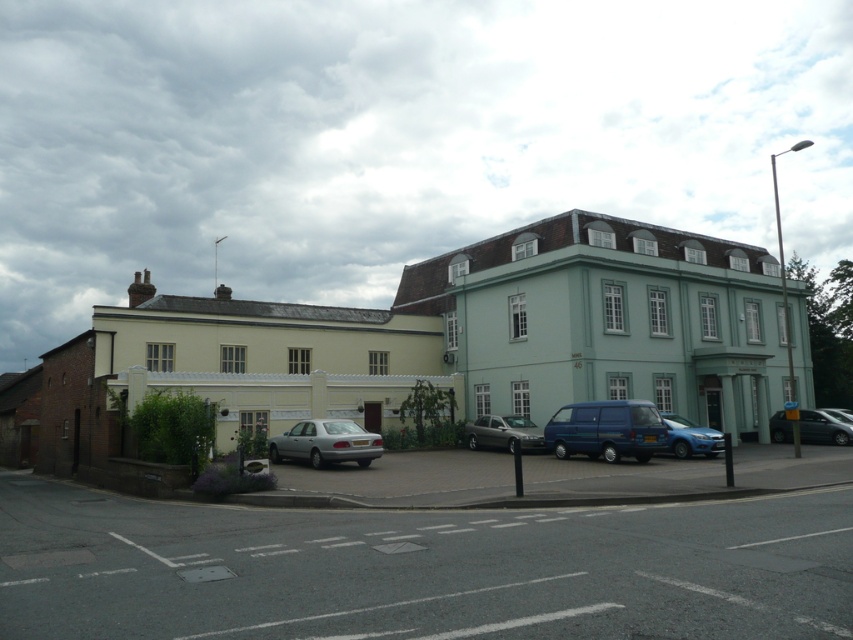
Question: Which is nearer to the metallic silver car at lower right?

Choices:
 (A) blue metallic van at center
 (B) satin silver sedan at center
 (C) satin silver sedan at lower left

Answer: (A)

Question: Can you confirm if gray asphalt parking lot at lower left is thinner than blue metallic van at center?

Choices:
 (A) yes
 (B) no

Answer: (B)

Question: Is blue metallic van at center bigger than satin silver sedan at lower left?

Choices:
 (A) no
 (B) yes

Answer: (B)

Question: Based on their relative distances, which object is nearer to the blue metallic van at center?

Choices:
 (A) gray asphalt parking lot at lower left
 (B) satin silver sedan at center
 (C) metallic blue hatchback at lower right

Answer: (C)

Question: Which object is closer to the camera taking this photo?

Choices:
 (A) metallic blue hatchback at lower right
 (B) gray asphalt parking lot at lower left

Answer: (B)

Question: Does gray asphalt parking lot at lower left appear over satin silver sedan at center?

Choices:
 (A) no
 (B) yes

Answer: (B)